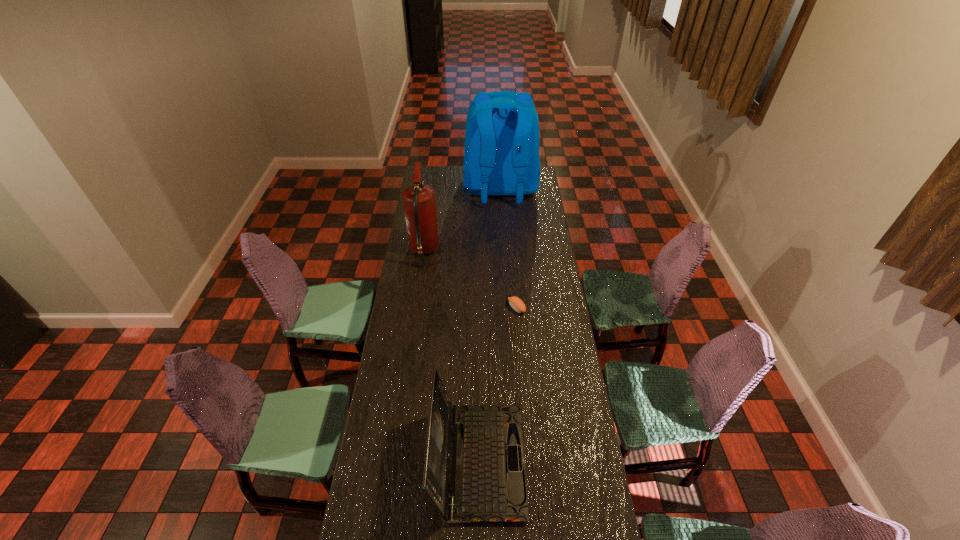
The width and height of the screenshot is (960, 540). Find the location of `blank region between the second nearest object and the fire extinguisher`. blank region between the second nearest object and the fire extinguisher is located at coordinates (470, 280).

Where is `free spot between the third shortest object and the backpack`? free spot between the third shortest object and the backpack is located at coordinates (462, 220).

Identify the location of vacant region between the leftmost object and the backpack. The width and height of the screenshot is (960, 540). (462, 220).

Where is `free space between the second shortest object and the farthest object`? free space between the second shortest object and the farthest object is located at coordinates (490, 325).

Find the location of a particular element. The width and height of the screenshot is (960, 540). free spot between the farthest object and the third shortest object is located at coordinates (462, 220).

Identify the location of empty space between the backpack and the leftmost object. This screenshot has height=540, width=960. coord(462,220).

This screenshot has width=960, height=540. In order to click on vacant region between the second shortest object and the tallest object in this screenshot , I will do `click(490, 325)`.

Find the location of `free space between the farthest object and the third nearest object`. free space between the farthest object and the third nearest object is located at coordinates [462, 220].

Locate an element on the screen. The image size is (960, 540). object that is the closest to the tallest object is located at coordinates (419, 202).

Locate which object is the second closest to the laptop computer. Please provide its 2D coordinates. Your answer should be formatted as a tuple, i.e. [(x, y)], where the tuple contains the x and y coordinates of a point satisfying the conditions above.

[(419, 202)]